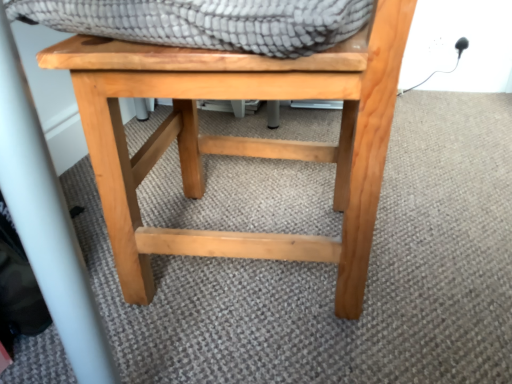
Question: Is natural wood stool at center taller or shorter than textured gray blanket at upper center?

Choices:
 (A) short
 (B) tall

Answer: (B)

Question: Is natural wood stool at center to the left or to the right of textured gray blanket at upper center in the image?

Choices:
 (A) left
 (B) right

Answer: (A)

Question: Do you think natural wood stool at center is within textured gray blanket at upper center, or outside of it?

Choices:
 (A) outside
 (B) inside

Answer: (A)

Question: From the image's perspective, is textured gray blanket at upper center positioned above or below natural wood stool at center?

Choices:
 (A) above
 (B) below

Answer: (A)

Question: Do you think textured gray blanket at upper center is within natural wood stool at center, or outside of it?

Choices:
 (A) outside
 (B) inside

Answer: (B)

Question: Looking at their shapes, would you say textured gray blanket at upper center is wider or thinner than natural wood stool at center?

Choices:
 (A) thin
 (B) wide

Answer: (A)

Question: Relative to natural wood stool at center, is textured gray blanket at upper center in front or behind?

Choices:
 (A) behind
 (B) front

Answer: (B)